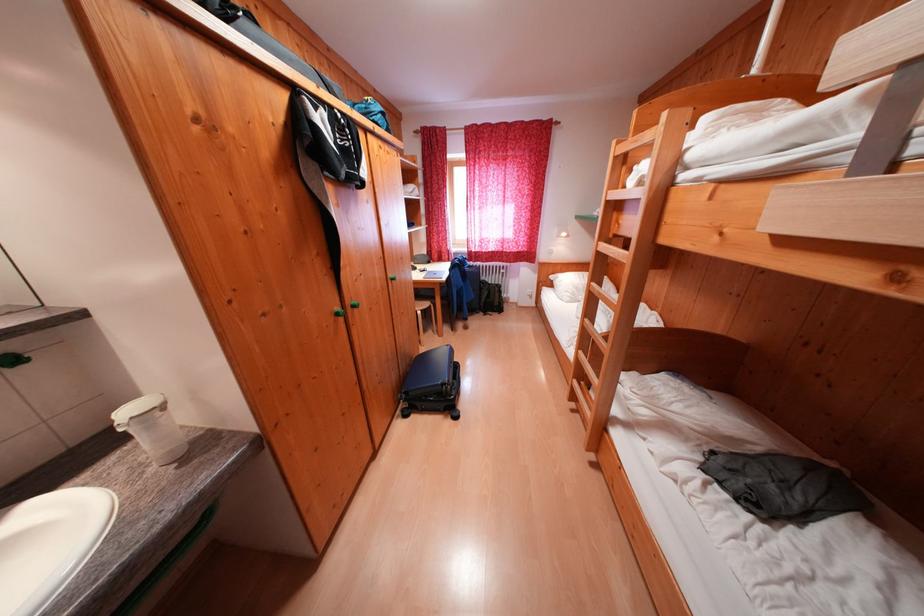
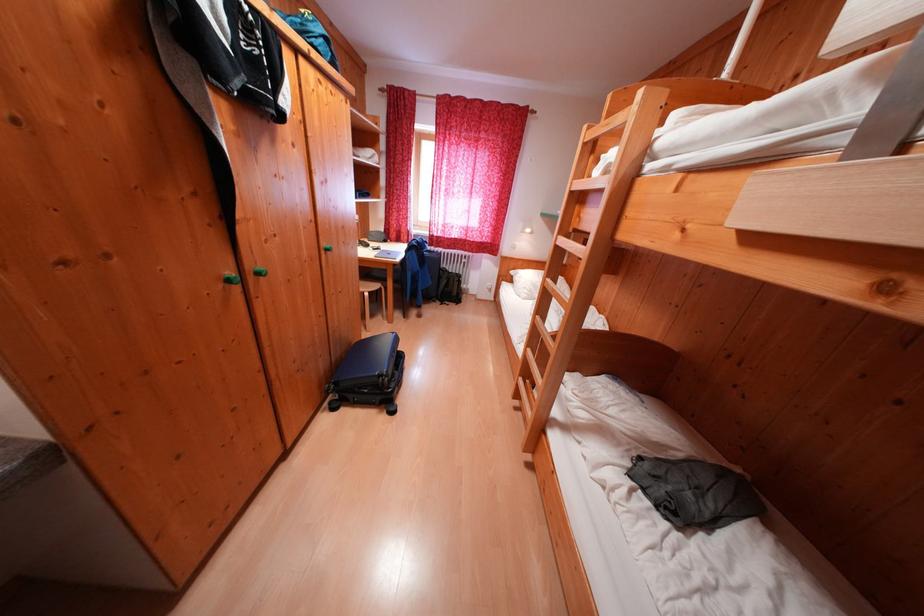
Locate, in the second image, the point that corresponds to (x=357, y=306) in the first image.

(258, 272)